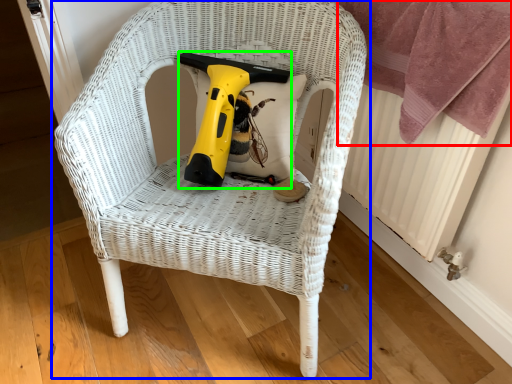
Question: Which is nearer to the blanket (highlighted by a red box)? chair (highlighted by a blue box) or electric drill (highlighted by a green box).

Choices:
 (A) chair
 (B) electric drill

Answer: (A)